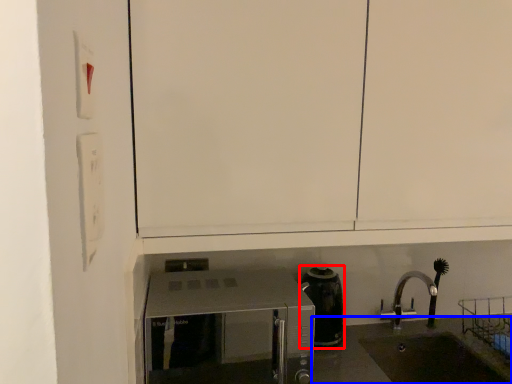
Question: Which of the following is the farthest to the observer, coffeepot (highlighted by a red box) or counter top (highlighted by a blue box)?

Choices:
 (A) coffeepot
 (B) counter top

Answer: (A)